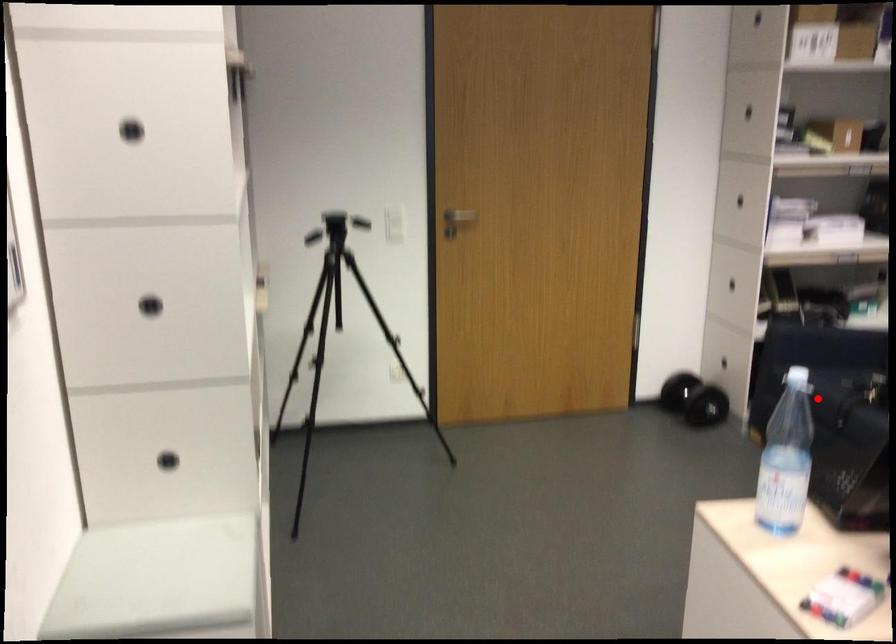
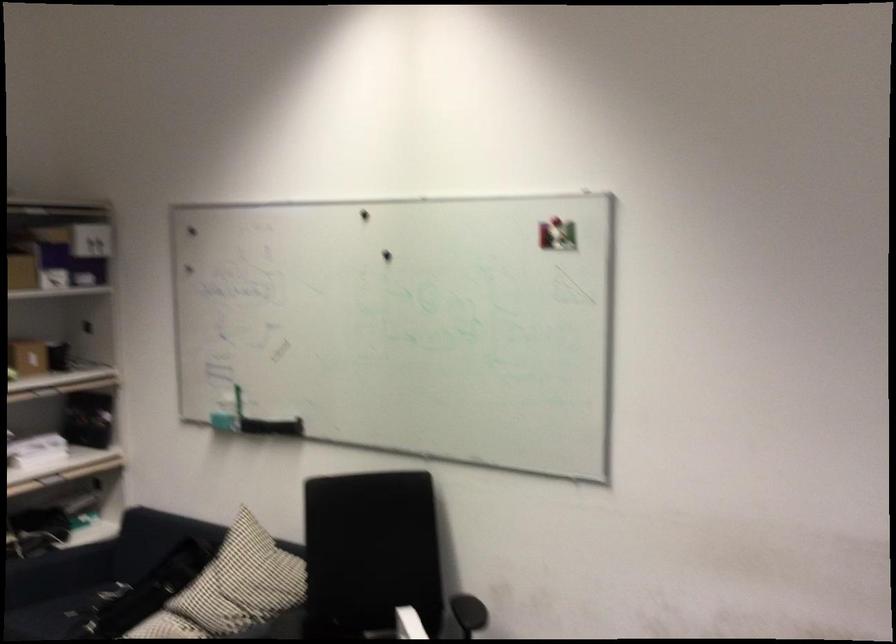
Locate, in the second image, the point that corresponds to the highlighted location in the first image.

(59, 614)